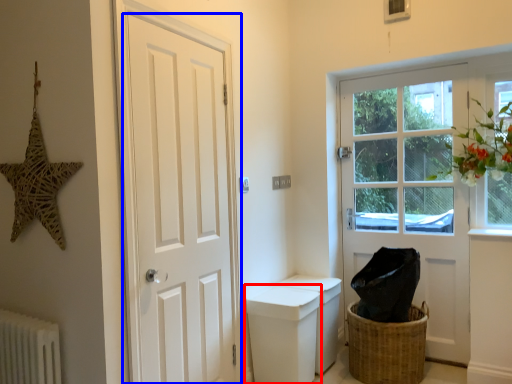
Question: Which point is closer to the camera, toilet bowl (highlighted by a red box) or door (highlighted by a blue box)?

Choices:
 (A) toilet bowl
 (B) door

Answer: (B)